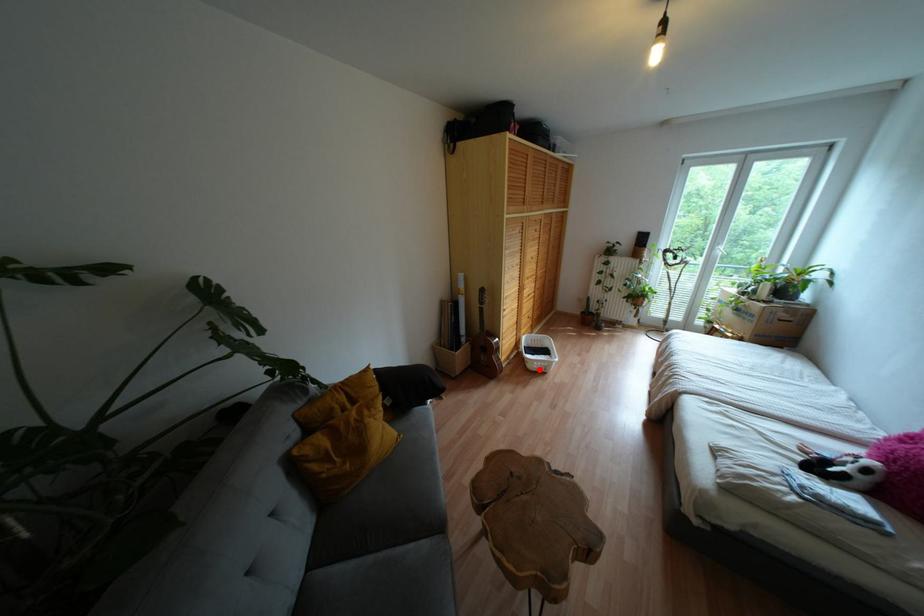
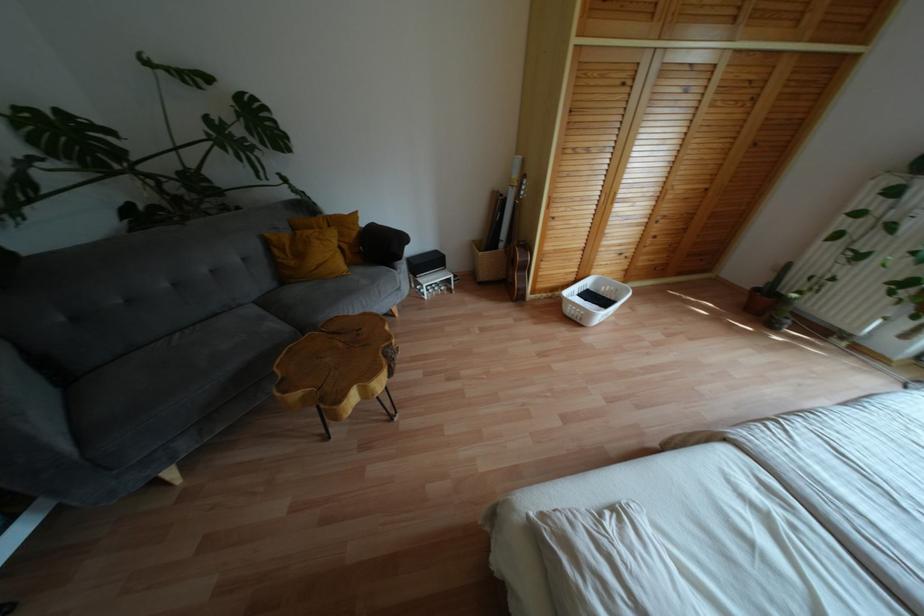
Locate, in the second image, the point that corresponds to the highlighted location in the first image.

(573, 318)